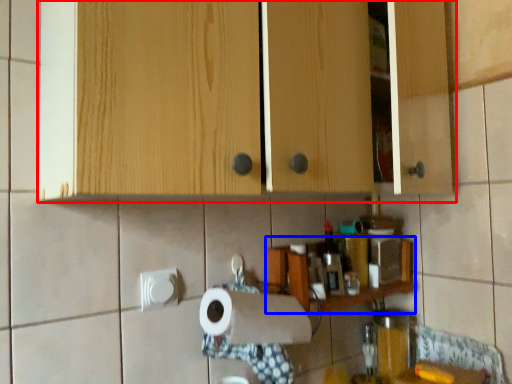
Question: Which object appears farthest to the camera in this image, cabinetry (highlighted by a red box) or shelf (highlighted by a blue box)?

Choices:
 (A) cabinetry
 (B) shelf

Answer: (B)